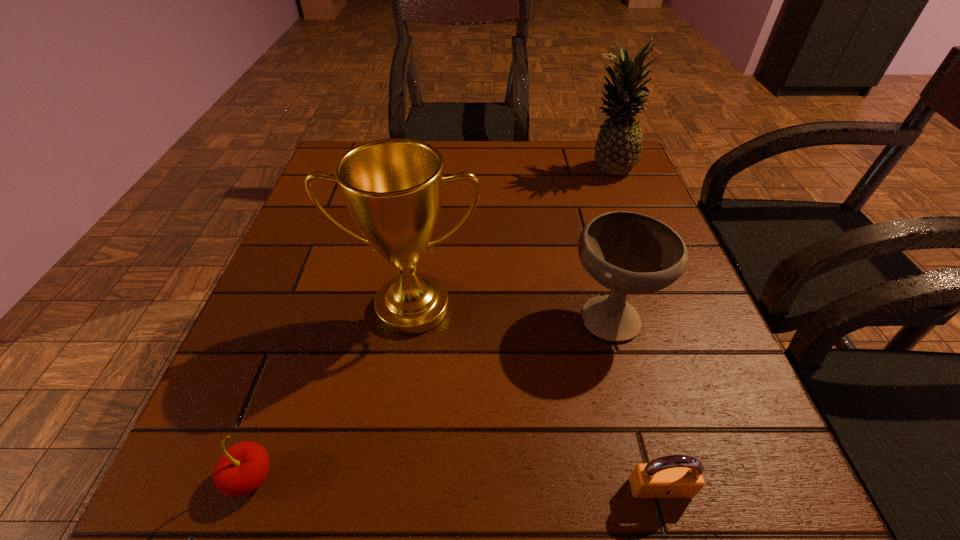
I want to click on object present at the near right corner, so click(674, 476).

Find the location of a particular element. vacant space at the far edge of the desktop is located at coordinates (543, 147).

In order to click on free space at the near edge of the desktop in this screenshot , I will do `click(483, 506)`.

At what (x,y) coordinates should I click in order to perform the action: click on blank area at the left edge. Please return your answer as a coordinate pair (x, y). This screenshot has height=540, width=960. Looking at the image, I should click on (316, 193).

You are a GUI agent. You are given a task and a screenshot of the screen. Output one action in this format:
    pyautogui.click(x=<x>, y=<y>)
    Task: Click on the vacant space at the right edge
    This screenshot has width=960, height=540.
    Given the screenshot: What is the action you would take?
    pyautogui.click(x=736, y=399)

I want to click on blank space at the far right corner of the desktop, so click(x=580, y=158).

In the image, there is a desktop. At what (x,y) coordinates should I click in order to perform the action: click on vacant space at the near right corner. Please return your answer as a coordinate pair (x, y). Looking at the image, I should click on (759, 517).

The image size is (960, 540). Identify the location of free area in between the pineapple and the fourth object from right to left. (510, 237).

You are a GUI agent. You are given a task and a screenshot of the screen. Output one action in this format:
    pyautogui.click(x=<x>, y=<y>)
    Task: Click on the free space between the pineapple and the award
    
    Given the screenshot: What is the action you would take?
    pyautogui.click(x=510, y=237)

Identify the location of vacant area that lies between the award and the third shortest object. tap(512, 310).